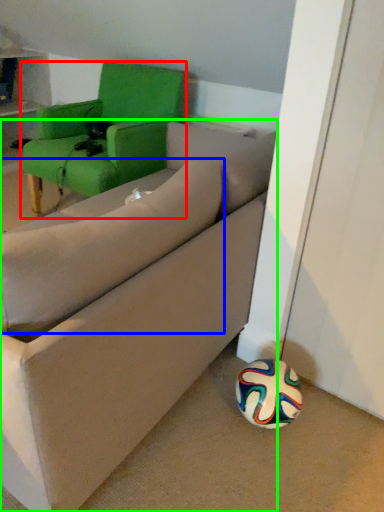
Question: Estimate the real-world distances between objects in this image. Which object is farther from chair (highlighted by a red box), pillow (highlighted by a blue box) or studio couch (highlighted by a green box)?

Choices:
 (A) pillow
 (B) studio couch

Answer: (A)